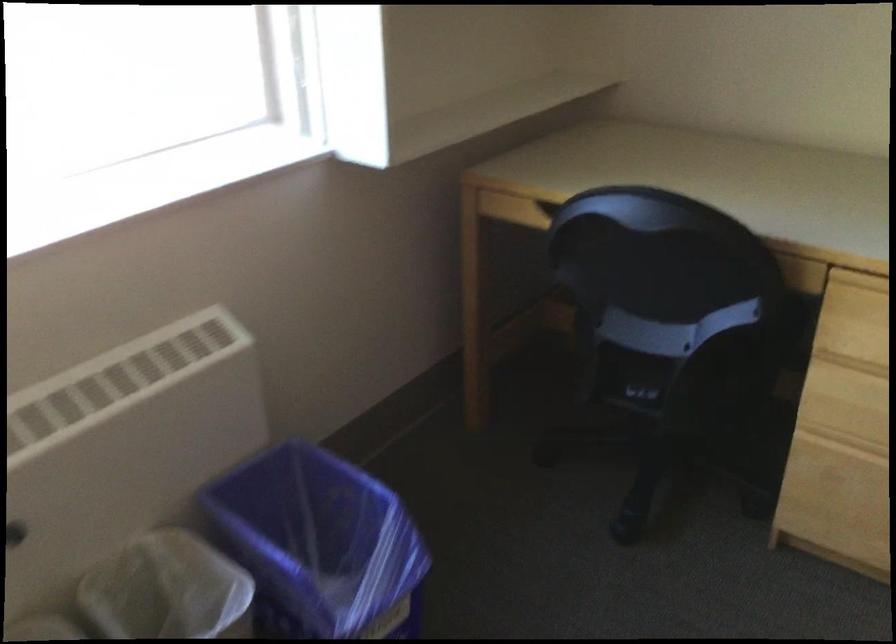
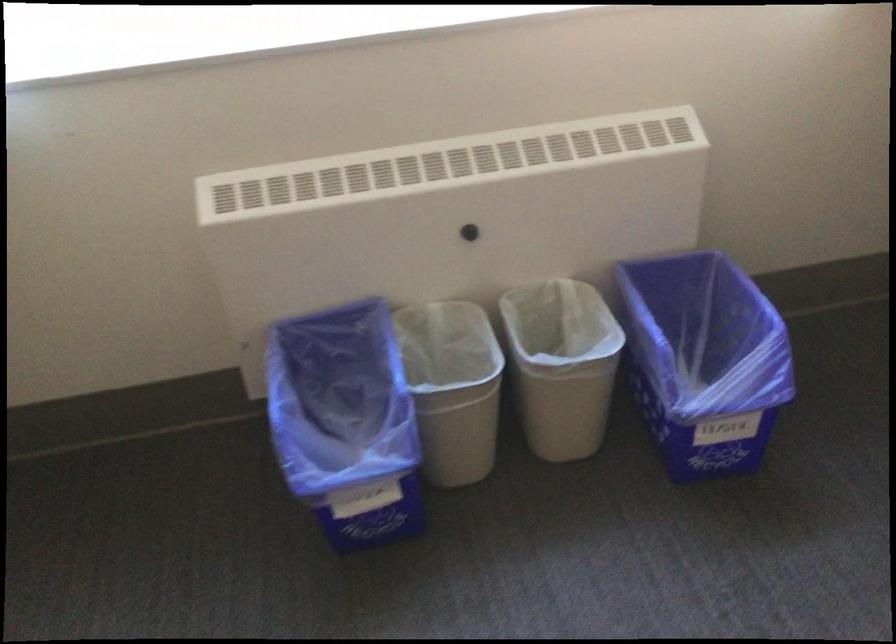
Find the pixel in the second image that matches (315,533) in the first image.

(702, 339)